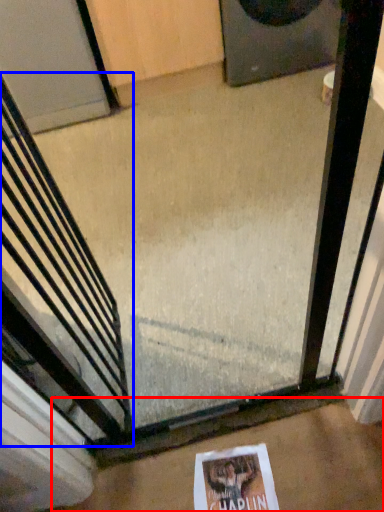
Question: Which point is further to the camera, concrete (highlighted by a red box) or escalator (highlighted by a blue box)?

Choices:
 (A) concrete
 (B) escalator

Answer: (A)